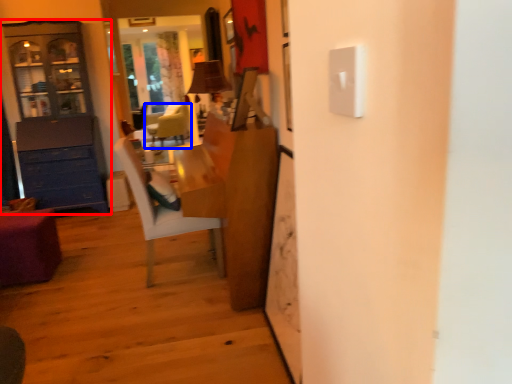
Question: Among these objects, which one is farthest to the camera, cabinetry (highlighted by a red box) or chair (highlighted by a blue box)?

Choices:
 (A) cabinetry
 (B) chair

Answer: (B)